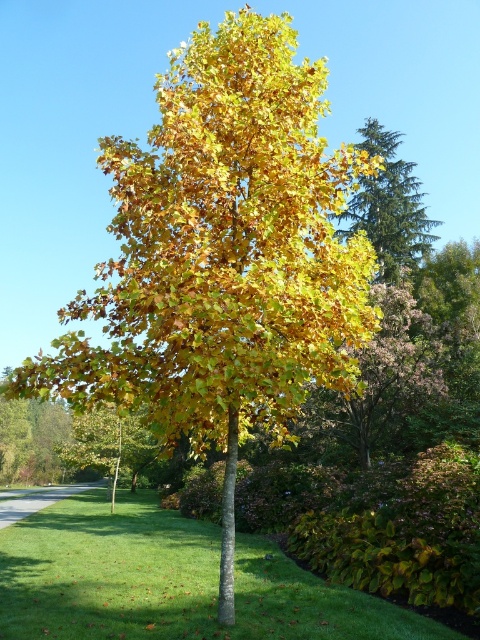
Question: Which object appears farthest from the camera in this image?

Choices:
 (A) golden yellow leaves at upper right
 (B) green grass at center
 (C) golden yellow leaves at center

Answer: (A)

Question: Does green grass at center have a lesser width compared to golden yellow leaves at center?

Choices:
 (A) no
 (B) yes

Answer: (A)

Question: Is golden yellow leaves at center below golden yellow leaves at upper right?

Choices:
 (A) no
 (B) yes

Answer: (B)

Question: Is the position of green grass at center less distant than that of golden yellow leaves at upper right?

Choices:
 (A) no
 (B) yes

Answer: (B)

Question: Which of the following is the farthest from the observer?

Choices:
 (A) (342, 396)
 (B) (432, 227)

Answer: (B)

Question: Which of the following is the farthest from the observer?

Choices:
 (A) (360, 355)
 (B) (361, 186)
 (C) (24, 636)

Answer: (B)